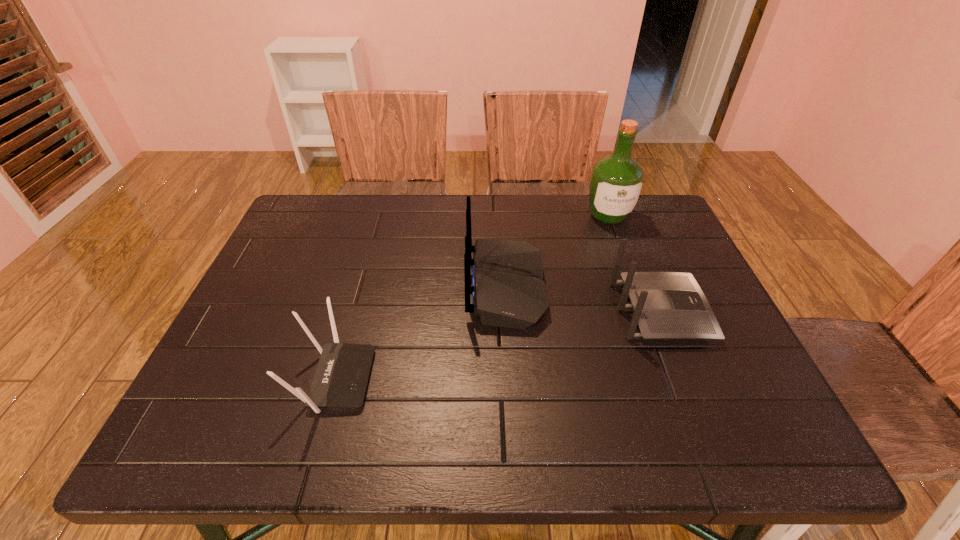
The image size is (960, 540). What are the coordinates of `vacant space located 0.250m on the back of the second tallest object` in the screenshot? It's located at (368, 287).

You are a GUI agent. You are given a task and a screenshot of the screen. Output one action in this format:
    pyautogui.click(x=<x>, y=<y>)
    Task: Click on the vacant space situated on the front-facing side of the leftmost object
    
    Given the screenshot: What is the action you would take?
    pyautogui.click(x=452, y=379)

Identify the location of object at the far edge. Image resolution: width=960 pixels, height=540 pixels. coord(616,182).

This screenshot has height=540, width=960. Find the location of `object at the near edge`. object at the near edge is located at coordinates (340, 381).

Locate an element on the screen. The image size is (960, 540). liquor that is positioned at the right edge is located at coordinates (616, 182).

The image size is (960, 540). Find the location of `router positioned at the right edge`. router positioned at the right edge is located at coordinates (666, 305).

I want to click on object that is at the far right corner, so click(616, 182).

Image resolution: width=960 pixels, height=540 pixels. Identify the location of free space at the far edge of the desktop. (530, 196).

Identify the location of vacant region at the near edge of the desktop. (586, 433).

Where is `free region at the left edge`? free region at the left edge is located at coordinates (292, 300).